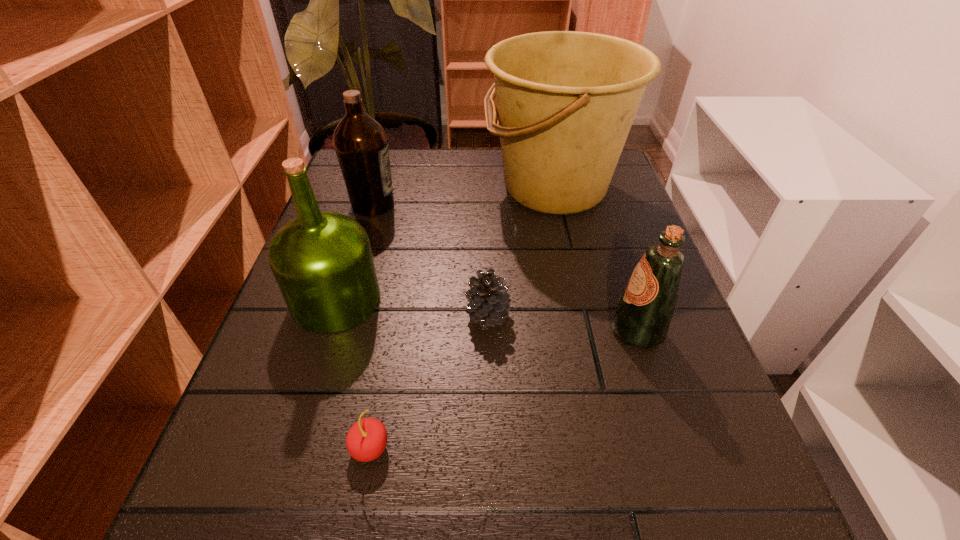
Where is `vacant space that is in between the pinecone and the farthest olive oil`? The height and width of the screenshot is (540, 960). vacant space that is in between the pinecone and the farthest olive oil is located at coordinates pos(431,260).

You are a GUI agent. You are given a task and a screenshot of the screen. Output one action in this format:
    pyautogui.click(x=<x>, y=<y>)
    Task: Click on the free space between the bucket and the farthest olive oil
    
    Given the screenshot: What is the action you would take?
    pyautogui.click(x=464, y=197)

Where is `free space between the pinecone and the bucket`? free space between the pinecone and the bucket is located at coordinates (521, 252).

Choose which object is the third nearest neighbor to the nearest object. Please provide its 2D coordinates. Your answer should be formatted as a tuple, i.e. [(x, y)], where the tuple contains the x and y coordinates of a point satisfying the conditions above.

[(643, 316)]

This screenshot has height=540, width=960. What are the coordinates of `object that stands as the fifth closest to the pinecone` in the screenshot? It's located at (361, 145).

Identify which olive oil is the closest to the farthest olive oil. Please provide its 2D coordinates. Your answer should be formatted as a tuple, i.e. [(x, y)], where the tuple contains the x and y coordinates of a point satisfying the conditions above.

[(323, 264)]

Select which olive oil appears as the closest to the pinecone. Please provide its 2D coordinates. Your answer should be formatted as a tuple, i.e. [(x, y)], where the tuple contains the x and y coordinates of a point satisfying the conditions above.

[(323, 264)]

I want to click on free space in the image that satisfies the following two spatial constraints: 1. on the label of the cherry; 2. on the right side of the farthest olive oil, so click(300, 448).

The image size is (960, 540). In order to click on vacant region that satisfies the following two spatial constraints: 1. on the label of the pinecone; 2. on the right side of the farthest olive oil in this screenshot , I will do `click(340, 315)`.